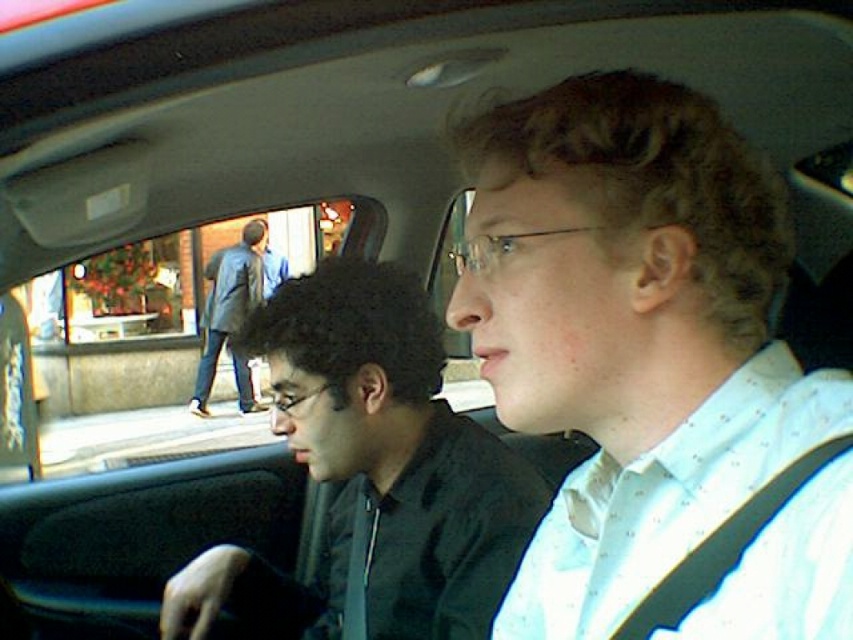
Question: Which point appears farthest from the camera in this image?

Choices:
 (A) (198, 400)
 (B) (474, 625)

Answer: (A)

Question: Observing the image, what is the correct spatial positioning of black matte shirt at center in reference to dark gray coat at center?

Choices:
 (A) below
 (B) above

Answer: (A)

Question: Observing the image, what is the correct spatial positioning of white dotted shirt at center in reference to black matte shirt at center?

Choices:
 (A) left
 (B) right

Answer: (B)

Question: Which of the following is the closest to the observer?

Choices:
 (A) (335, 321)
 (B) (244, 291)

Answer: (A)

Question: Does black matte shirt at center appear over dark gray coat at center?

Choices:
 (A) yes
 (B) no

Answer: (B)

Question: Which object is the farthest from the dark gray coat at center?

Choices:
 (A) white dotted shirt at center
 (B) black matte shirt at center

Answer: (A)